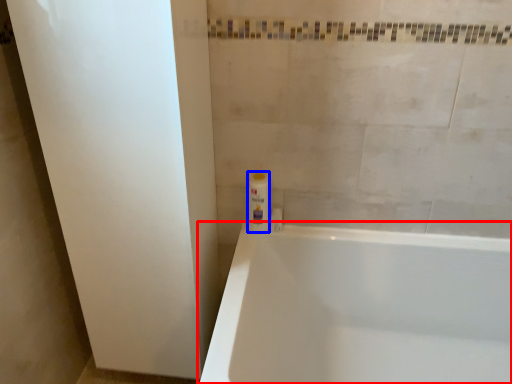
Question: Which object is closer to the camera taking this photo, bathtub (highlighted by a red box) or toiletry (highlighted by a blue box)?

Choices:
 (A) bathtub
 (B) toiletry

Answer: (A)